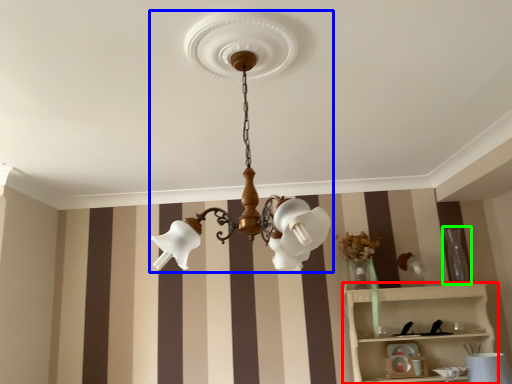
Question: Which object is the farthest from shelf (highlighted by a red box)? Choose among these: lamp (highlighted by a blue box) or vase (highlighted by a green box).

Choices:
 (A) lamp
 (B) vase

Answer: (A)